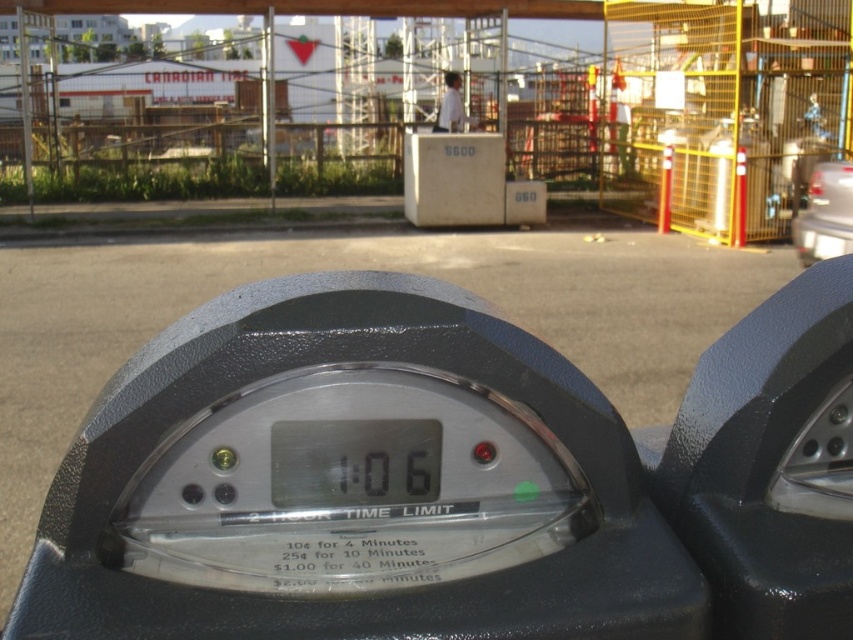
Is point (770, 516) positioned behind point (462, 116)?

No, it is in front of (462, 116).

Does black matte parking meter at center have a smaller size compared to white shirt at upper center?

Yes, black matte parking meter at center is smaller than white shirt at upper center.

Who is more forward, (718, 410) or (450, 76)?

Positioned in front is point (718, 410).

This screenshot has height=640, width=853. I want to click on black matte parking meter at center, so pos(770,465).

Which is above, black plastic parking meter at center or metal scaffolding at center?

Positioned higher is metal scaffolding at center.

Is black plastic parking meter at center taller than metal scaffolding at center?

In fact, black plastic parking meter at center may be shorter than metal scaffolding at center.

You are a GUI agent. You are given a task and a screenshot of the screen. Output one action in this format:
    pyautogui.click(x=<x>, y=<y>)
    Task: Click on the black plastic parking meter at center
    The width and height of the screenshot is (853, 640).
    Given the screenshot: What is the action you would take?
    pyautogui.click(x=538, y=442)

Locate an element on the screen. The image size is (853, 640). black plastic parking meter at center is located at coordinates (538, 442).

Can you confirm if black plastic parking meter at center is shorter than metallic silver car at right?

Indeed, black plastic parking meter at center has a lesser height compared to metallic silver car at right.

Which is above, black plastic parking meter at center or metallic silver car at right?

Positioned higher is metallic silver car at right.

Is point (817, 451) positioned before point (811, 170)?

Yes, it is in front of point (811, 170).

Find the location of a particular element. This screenshot has height=640, width=853. black plastic parking meter at center is located at coordinates (538, 442).